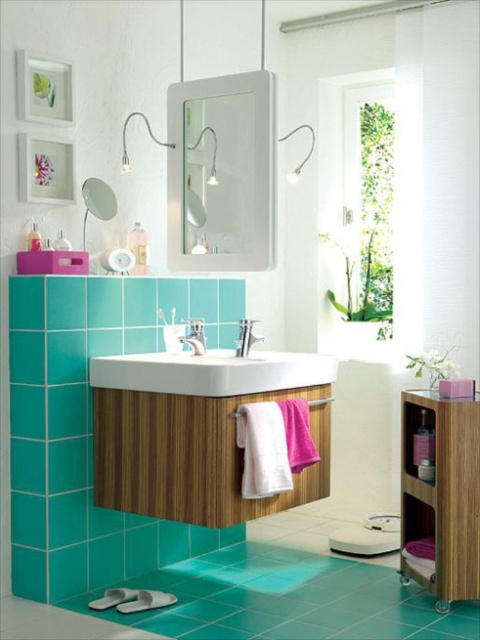
You are a maintenance worker who needs to clean the white glossy sink at center. You have a 2 meter long extension pole. Can you reach the sink from where you are standing?

The white glossy sink at center is 2.36 meters away from the viewer. Since the extension pole is only 2 meters long, it is not long enough to reach the sink. You will need a longer tool to clean it.